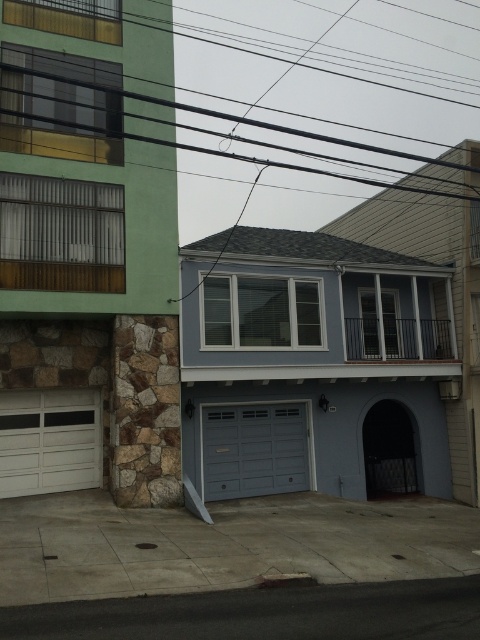
Question: Which point is farther to the camera?

Choices:
 (A) gray matte/glossy garage door at center
 (B) black wire at upper center
 (C) matte gray garage door at center
 (D) white matte/glossy garage door at lower left

Answer: (A)

Question: Is white matte/glossy garage door at lower left further to camera compared to gray matte/glossy garage door at center?

Choices:
 (A) yes
 (B) no

Answer: (B)

Question: Considering the real-world distances, which object is farthest from the white matte/glossy garage door at lower left?

Choices:
 (A) gray matte/glossy garage door at center
 (B) matte gray garage door at center

Answer: (B)

Question: Is matte gray garage door at center positioned in front of white matte/glossy garage door at lower left?

Choices:
 (A) no
 (B) yes

Answer: (A)

Question: Among these objects, which one is nearest to the camera?

Choices:
 (A) gray matte/glossy garage door at center
 (B) white matte/glossy garage door at lower left
 (C) matte gray garage door at center

Answer: (B)

Question: Does matte gray garage door at center lie in front of gray matte/glossy garage door at center?

Choices:
 (A) no
 (B) yes

Answer: (B)